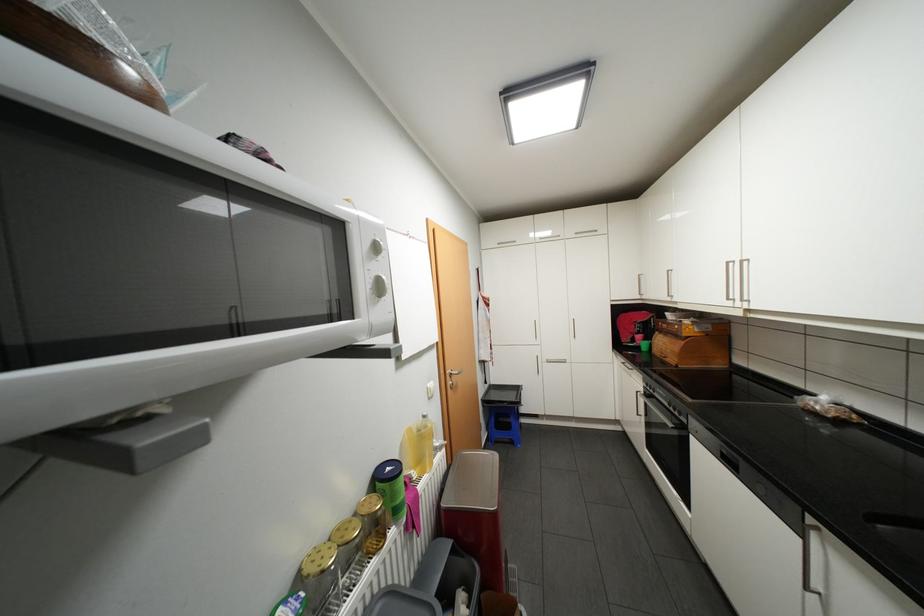
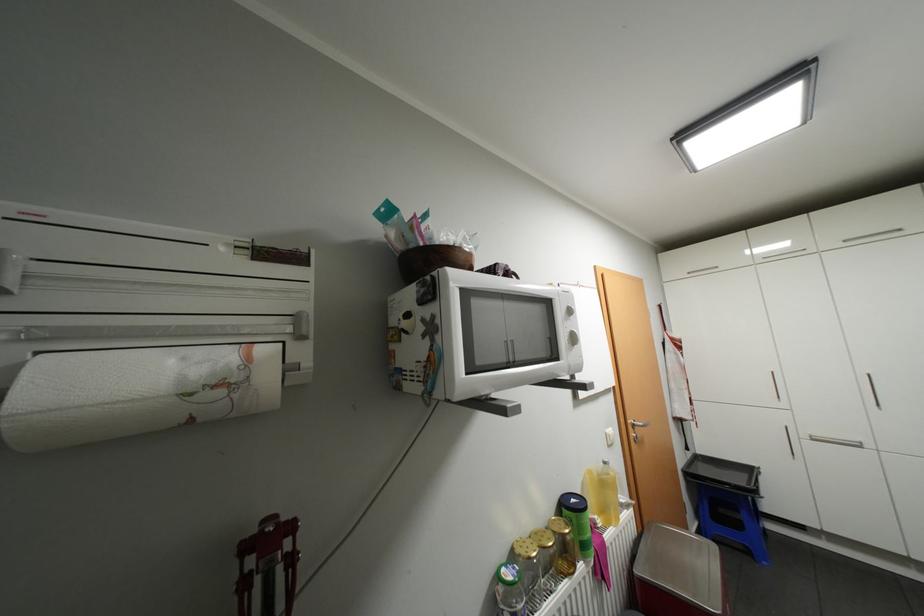
Find the pixel in the second image that matches [402,495] in the first image.

(589, 528)